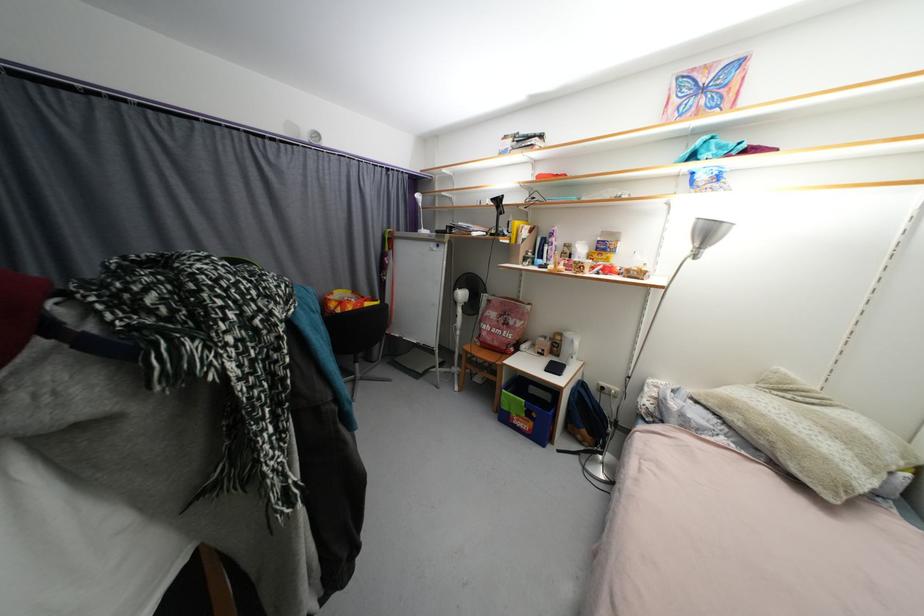
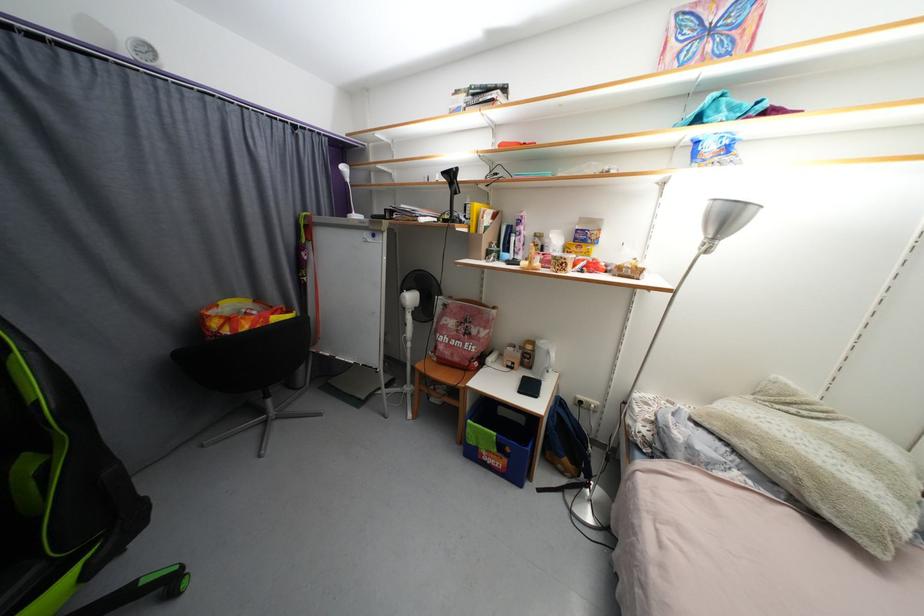
Question: The camera is either moving clockwise (left) or counter-clockwise (right) around the object. The first image is from the beginning of the video and the second image is from the end. Is the camera moving left or right when shooting the video?

Choices:
 (A) Left
 (B) Right

Answer: (A)